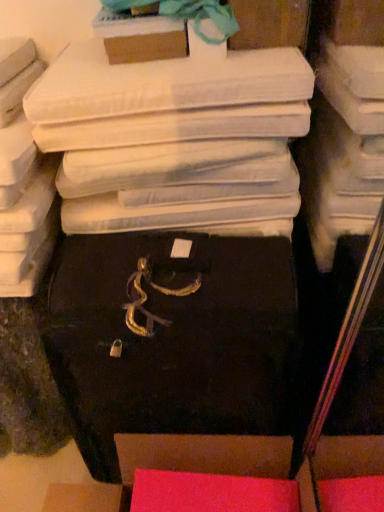
Question: Can you confirm if matte cardboard box at upper center, the 2th storage box when ordered from top to bottom, is thinner than matte white storage box at upper center, which appears as the 1th storage box when viewed from the top?

Choices:
 (A) yes
 (B) no

Answer: (A)

Question: Is matte cardboard box at upper center, which is the third storage box from bottom to top, with matte white storage box at upper center, which is counted as the 4th storage box, starting from the bottom?

Choices:
 (A) no
 (B) yes

Answer: (A)

Question: Is matte cardboard box at upper center, the 2th storage box when ordered from top to bottom, outside of matte white storage box at upper center, which is counted as the 4th storage box, starting from the bottom?

Choices:
 (A) no
 (B) yes

Answer: (B)

Question: Can you confirm if matte cardboard box at upper center, which is the third storage box from bottom to top, is positioned to the right of matte white storage box at upper center, which appears as the 1th storage box when viewed from the top?

Choices:
 (A) no
 (B) yes

Answer: (A)

Question: From the image's perspective, is matte cardboard box at upper center, which is the third storage box from bottom to top, located beneath matte white storage box at upper center, which is counted as the 4th storage box, starting from the bottom?

Choices:
 (A) no
 (B) yes

Answer: (B)

Question: From a real-world perspective, is matte white storage box at upper center, which appears as the 1th storage box when viewed from the top, above or below black matte suitcase at center, which appears as the second storage box when ordered from the bottom?

Choices:
 (A) below
 (B) above

Answer: (B)

Question: In the image, is matte white storage box at upper center, which appears as the 1th storage box when viewed from the top, positioned in front of or behind black matte suitcase at center, which appears as the second storage box when ordered from the bottom?

Choices:
 (A) behind
 (B) front

Answer: (A)

Question: Which is correct: matte white storage box at upper center, which appears as the 1th storage box when viewed from the top, is inside black matte suitcase at center, which appears as the second storage box when ordered from the bottom, or outside of it?

Choices:
 (A) outside
 (B) inside

Answer: (A)

Question: Is matte white storage box at upper center, which is counted as the 4th storage box, starting from the bottom, to the left or to the right of black matte suitcase at center, which appears as the second storage box when ordered from the bottom, in the image?

Choices:
 (A) right
 (B) left

Answer: (A)

Question: Is black matte suitcase at center, the third storage box in the top-to-bottom sequence, taller or shorter than matte cardboard box at upper center, the 2th storage box when ordered from top to bottom?

Choices:
 (A) tall
 (B) short

Answer: (A)

Question: Considering their positions, is black matte suitcase at center, the third storage box in the top-to-bottom sequence, located in front of or behind matte cardboard box at upper center, which is the third storage box from bottom to top?

Choices:
 (A) behind
 (B) front

Answer: (B)

Question: Considering the relative positions of black matte suitcase at center, which appears as the second storage box when ordered from the bottom, and matte cardboard box at upper center, the 2th storage box when ordered from top to bottom, in the image provided, is black matte suitcase at center, which appears as the second storage box when ordered from the bottom, to the left or to the right of matte cardboard box at upper center, the 2th storage box when ordered from top to bottom,?

Choices:
 (A) right
 (B) left

Answer: (A)

Question: From a real-world perspective, is black matte suitcase at center, the third storage box in the top-to-bottom sequence, above or below matte cardboard box at upper center, the 2th storage box when ordered from top to bottom?

Choices:
 (A) above
 (B) below

Answer: (B)

Question: Is point (153, 53) positioned closer to the camera than point (271, 442)?

Choices:
 (A) farther
 (B) closer

Answer: (B)

Question: Would you say matte cardboard box at upper center, which is the third storage box from bottom to top, is to the left or to the right of matte pink box at lower center, marked as the first storage box in a bottom-to-top arrangement, in the picture?

Choices:
 (A) right
 (B) left

Answer: (B)